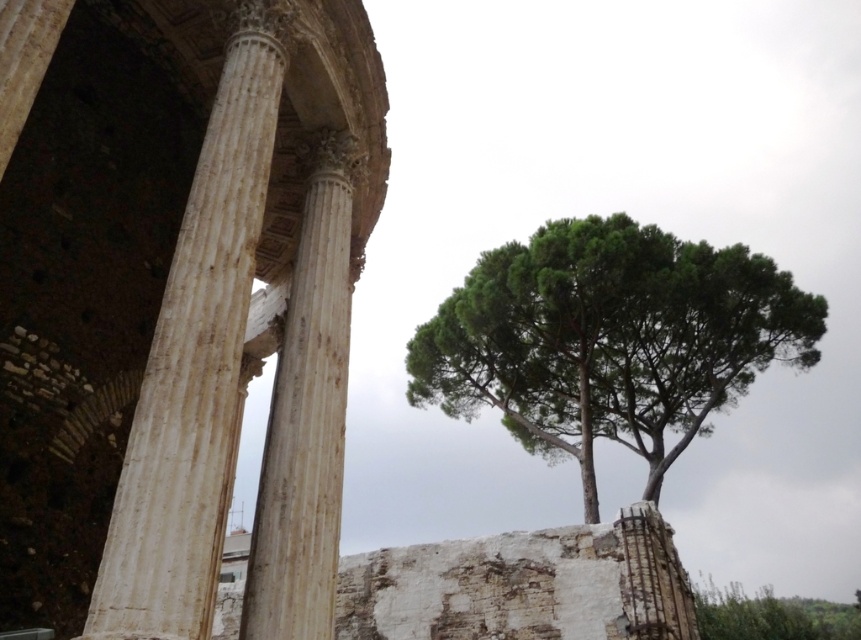
Question: Which point appears closest to the camera in this image?

Choices:
 (A) (333, 461)
 (B) (240, 36)
 (C) (481, 280)

Answer: (B)

Question: Considering the real-world distances, which object is farthest from the white marble column at left?

Choices:
 (A) white marble column at center
 (B) green leafy tree at upper right

Answer: (B)

Question: Is green leafy tree at upper right closer to the viewer compared to white marble column at left?

Choices:
 (A) no
 (B) yes

Answer: (A)

Question: Can you confirm if green leafy tree at upper right is positioned to the left of white marble column at left?

Choices:
 (A) yes
 (B) no

Answer: (B)

Question: Is white marble column at left to the right of white marble column at center from the viewer's perspective?

Choices:
 (A) no
 (B) yes

Answer: (A)

Question: Among these points, which one is farthest from the camera?

Choices:
 (A) (336, 332)
 (B) (110, 621)
 (C) (544, 353)

Answer: (C)